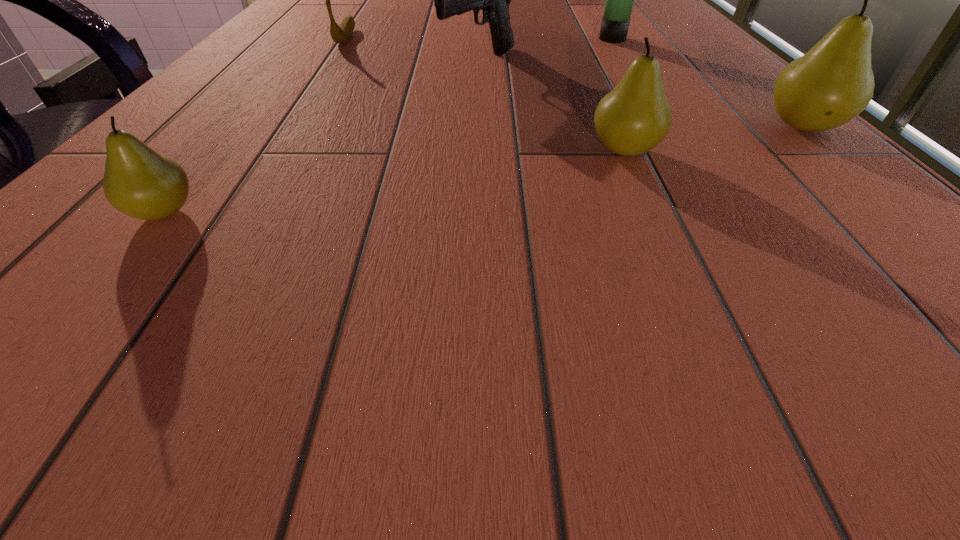
If we want them evenly spaced by inserting an extra pear among them, please locate a free spot for this new pear. Please provide its 2D coordinates. Your answer should be formatted as a tuple, i.e. [(x, y)], where the tuple contains the x and y coordinates of a point satisfying the conditions above.

[(415, 179)]